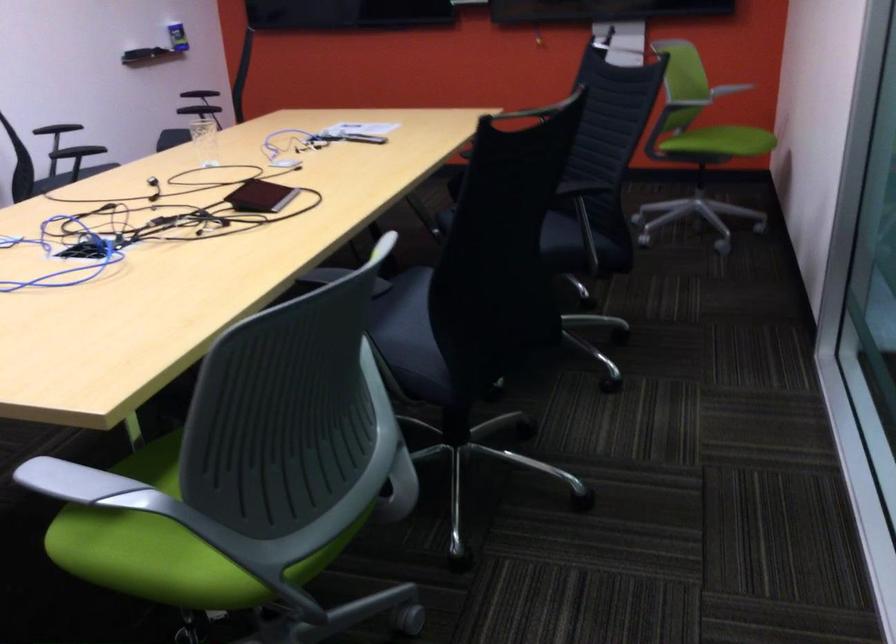
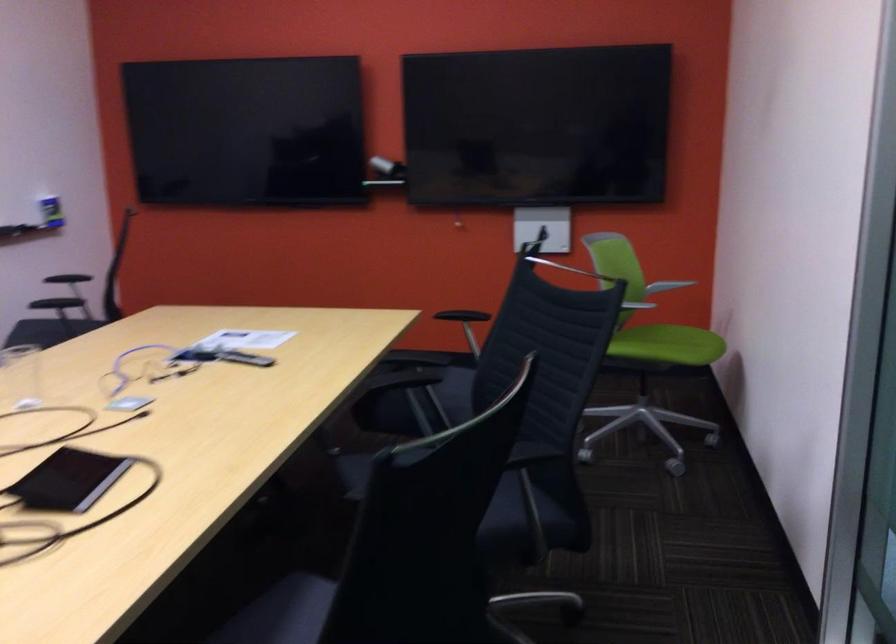
Find the pixel in the second image that matches point (403, 287) in the first image.

(280, 612)